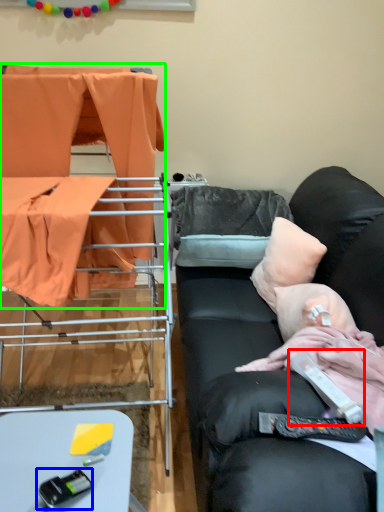
Question: Which object is positioned closest to equipment (highlighted by a red box)? Select from equipment (highlighted by a blue box) and furniture (highlighted by a green box).

Choices:
 (A) equipment
 (B) furniture

Answer: (A)